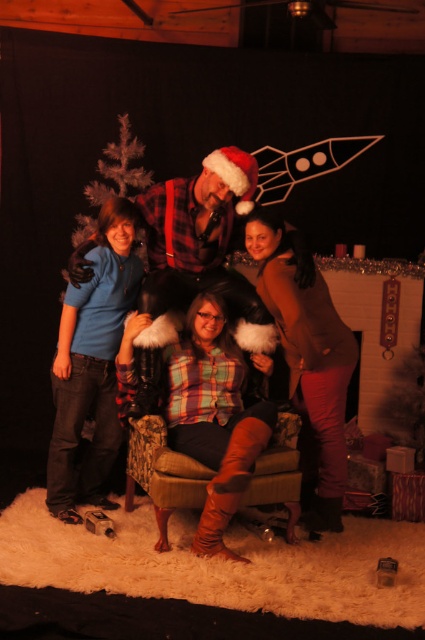
You are standing at the point labeled point (312, 362) in the image. If you want to move towards the point labeled point (64, 435), which direction should you move?

To move from point (312, 362) to point (64, 435), you should move towards the right and downward since point (64, 435) is behind point (312, 362).

You are a photographer trying to adjust the lighting for a group photo. You notice the brown matte sweater at upper right and the matte blue shirt at left are both in the frame. Which one is positioned farther away from the camera?

The brown matte sweater at upper right is behind the matte blue shirt at left, so it is farther away from the camera.